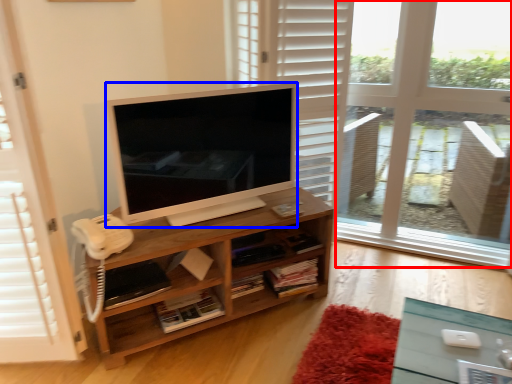
Question: Among these objects, which one is nearest to the camera, window frame (highlighted by a red box) or television (highlighted by a blue box)?

Choices:
 (A) window frame
 (B) television

Answer: (B)